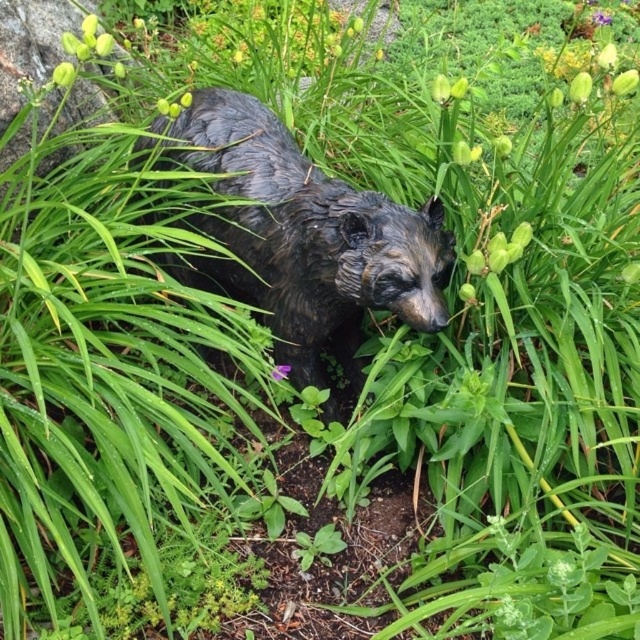
Can you confirm if bronze statue of bear at center is smaller than purple matte flower at center?

Actually, bronze statue of bear at center might be larger than purple matte flower at center.

Is bronze statue of bear at center closer to the viewer compared to purple matte flower at center?

Yes, bronze statue of bear at center is in front of purple matte flower at center.

Does point (262, 108) come farther from viewer compared to point (285, 374)?

Yes, point (262, 108) is behind point (285, 374).

The image size is (640, 640). What are the coordinates of `bronze statue of bear at center` in the screenshot? It's located at (308, 237).